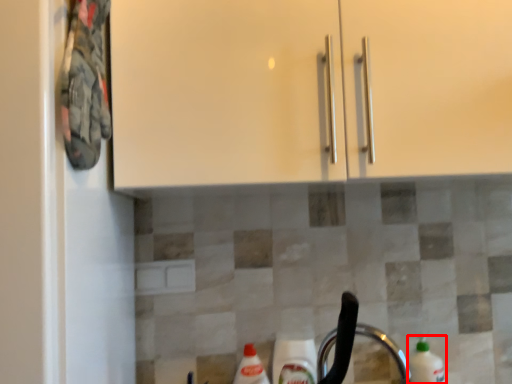
Question: From the image's perspective, considering the relative positions of cleaning product (annotated by the red box) and faucet in the image provided, where is cleaning product (annotated by the red box) located with respect to the staircase?

Choices:
 (A) above
 (B) below

Answer: (B)